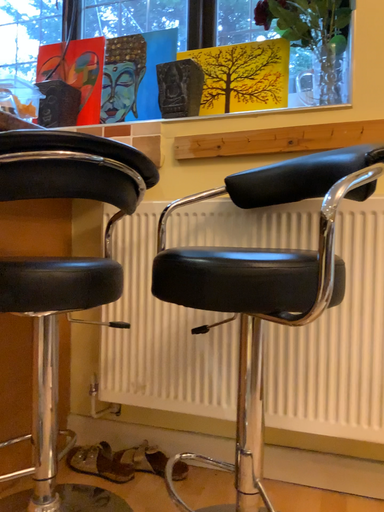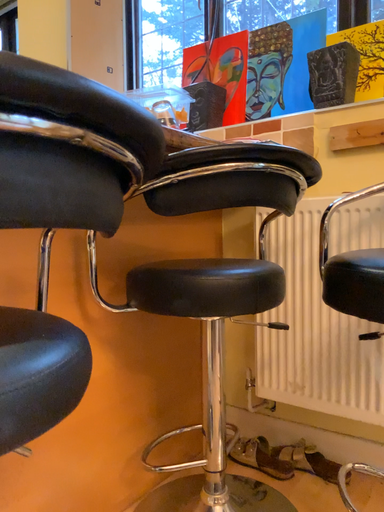
Question: How did the camera likely rotate when shooting the video?

Choices:
 (A) rotated right
 (B) rotated left

Answer: (B)